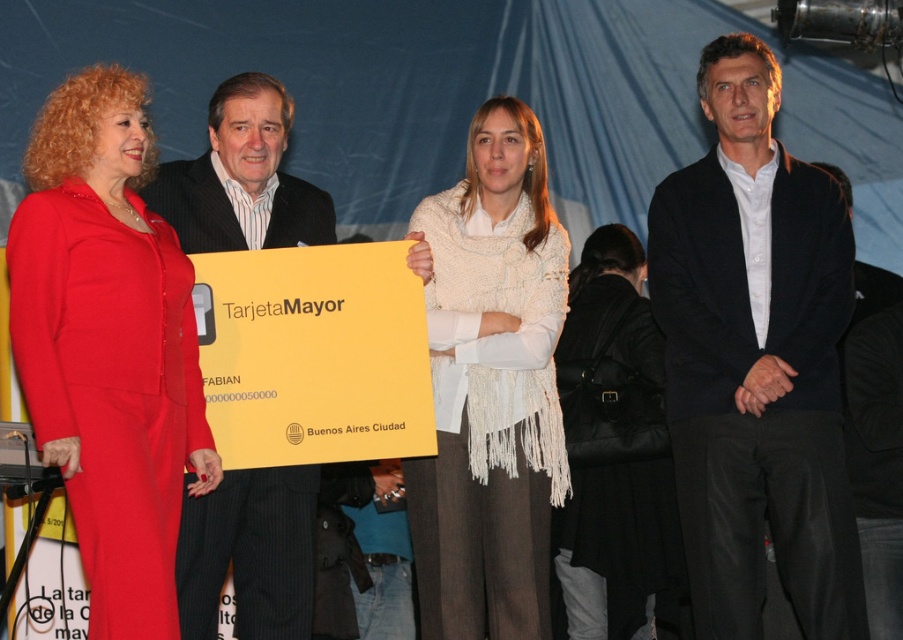
You are attending a formal event and need to take a photo with the matte red dress at left and the white knitted scarf at center. Which object should you position closer to the camera to ensure both are fully visible in the frame?

You should position the matte red dress at left closer to the camera because it might be wider than the white knitted scarf at center, ensuring both fit within the frame.

You are attending a formal event and notice two items at the center of the scene. Which item is taller between the white knitted scarf at center and the black leather handbag at center?

The white knitted scarf at center is taller than the black leather handbag at center.